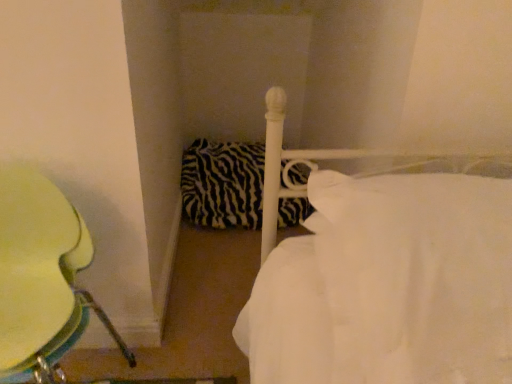
Question: From a real-world perspective, is metallic green chair at left under white smooth bed at center?

Choices:
 (A) no
 (B) yes

Answer: (B)

Question: Considering the relative sizes of metallic green chair at left and white smooth bed at center in the image provided, is metallic green chair at left wider than white smooth bed at center?

Choices:
 (A) yes
 (B) no

Answer: (B)

Question: Are metallic green chair at left and white smooth bed at center located far from each other?

Choices:
 (A) yes
 (B) no

Answer: (B)

Question: Is metallic green chair at left looking in the opposite direction of white smooth bed at center?

Choices:
 (A) yes
 (B) no

Answer: (B)

Question: Is metallic green chair at left shorter than white smooth bed at center?

Choices:
 (A) yes
 (B) no

Answer: (B)

Question: Is metallic green chair at left outside of white smooth bed at center?

Choices:
 (A) yes
 (B) no

Answer: (A)

Question: Is metallic green chair at left aimed at zebra-patterned fabric pillow at center?

Choices:
 (A) yes
 (B) no

Answer: (B)

Question: From a real-world perspective, is metallic green chair at left on top of zebra-patterned fabric pillow at center?

Choices:
 (A) no
 (B) yes

Answer: (B)

Question: Is metallic green chair at left wider than zebra-patterned fabric pillow at center?

Choices:
 (A) no
 (B) yes

Answer: (A)

Question: Is metallic green chair at left turned away from zebra-patterned fabric pillow at center?

Choices:
 (A) no
 (B) yes

Answer: (A)

Question: Are metallic green chair at left and zebra-patterned fabric pillow at center beside each other?

Choices:
 (A) no
 (B) yes

Answer: (A)

Question: Can you confirm if metallic green chair at left is thinner than zebra-patterned fabric pillow at center?

Choices:
 (A) yes
 (B) no

Answer: (A)

Question: Considering the relative sizes of white smooth bed at center and metallic green chair at left in the image provided, is white smooth bed at center thinner than metallic green chair at left?

Choices:
 (A) yes
 (B) no

Answer: (B)